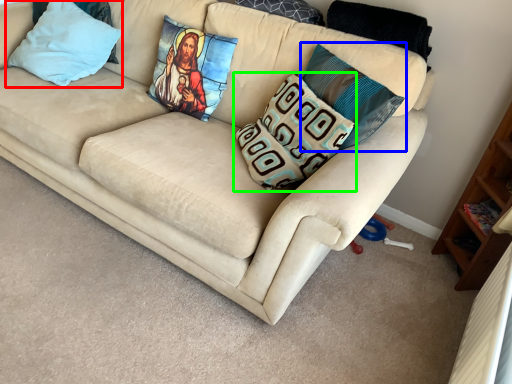
Question: Which is farther away from pillow (highlighted by a red box)? pillow (highlighted by a blue box) or pillow (highlighted by a green box)?

Choices:
 (A) pillow
 (B) pillow

Answer: (A)